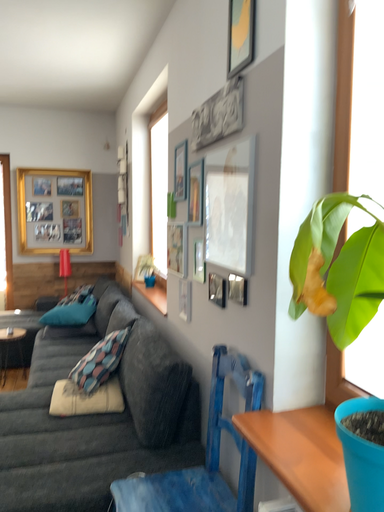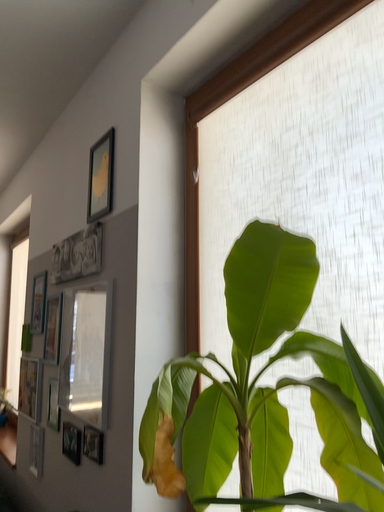
Question: Which way did the camera rotate in the video?

Choices:
 (A) rotated downward
 (B) rotated upward

Answer: (B)